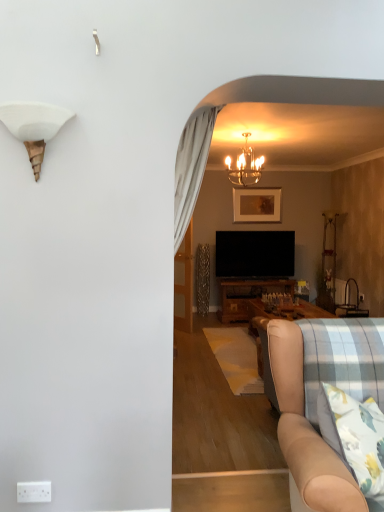
Question: From the image's perspective, is white plastic power outlet at lower left under beige fabric couch at lower right?

Choices:
 (A) no
 (B) yes

Answer: (B)

Question: Does white plastic power outlet at lower left have a greater width compared to beige fabric couch at lower right?

Choices:
 (A) no
 (B) yes

Answer: (A)

Question: Does white plastic power outlet at lower left lie in front of beige fabric couch at lower right?

Choices:
 (A) yes
 (B) no

Answer: (B)

Question: Is white plastic power outlet at lower left further to camera compared to beige fabric couch at lower right?

Choices:
 (A) yes
 (B) no

Answer: (A)

Question: From a real-world perspective, is white plastic power outlet at lower left located beneath beige fabric couch at lower right?

Choices:
 (A) no
 (B) yes

Answer: (B)

Question: Considering the positions of white matte shell at upper left, positioned as the second lamp in right-to-left order, and translucent glass chandelier at upper center, the second lamp when ordered from left to right, in the image, is white matte shell at upper left, positioned as the second lamp in right-to-left order, bigger or smaller than translucent glass chandelier at upper center, the second lamp when ordered from left to right,?

Choices:
 (A) big
 (B) small

Answer: (B)

Question: Is white matte shell at upper left, positioned as the second lamp in right-to-left order, inside the boundaries of translucent glass chandelier at upper center, marked as the first lamp in a right-to-left arrangement, or outside?

Choices:
 (A) inside
 (B) outside

Answer: (B)

Question: Is white matte shell at upper left, positioned as the second lamp in right-to-left order, in front of or behind translucent glass chandelier at upper center, the second lamp from the front, in the image?

Choices:
 (A) front
 (B) behind

Answer: (A)

Question: In terms of height, does white matte shell at upper left, the 1th lamp in the bottom-to-top sequence, look taller or shorter compared to translucent glass chandelier at upper center, which ranks as the first lamp in top-to-bottom order?

Choices:
 (A) short
 (B) tall

Answer: (A)

Question: Is point (173, 322) closer or farther from the camera than point (233, 166)?

Choices:
 (A) closer
 (B) farther

Answer: (A)

Question: Based on their positions, is transparent glass door at center located to the left or right of translucent glass chandelier at upper center, marked as the first lamp in a right-to-left arrangement?

Choices:
 (A) left
 (B) right

Answer: (A)

Question: From a real-world perspective, is transparent glass door at center positioned above or below translucent glass chandelier at upper center, which ranks as the first lamp in top-to-bottom order?

Choices:
 (A) above
 (B) below

Answer: (B)

Question: Considering their positions, is transparent glass door at center located in front of or behind translucent glass chandelier at upper center, the second lamp when ordered from left to right?

Choices:
 (A) front
 (B) behind

Answer: (B)

Question: In the image, is translucent glass chandelier at upper center, which ranks as the 2th lamp in bottom-to-top order, on the left side or the right side of white plastic power outlet at lower left?

Choices:
 (A) right
 (B) left

Answer: (A)

Question: In the image, is translucent glass chandelier at upper center, marked as the first lamp in a right-to-left arrangement, positioned in front of or behind white plastic power outlet at lower left?

Choices:
 (A) front
 (B) behind

Answer: (B)